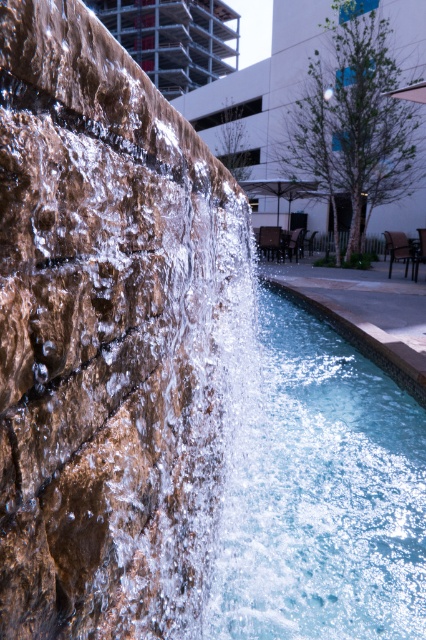
Question: Does clear glass swimming pool at center have a smaller size compared to smooth concrete wall at center?

Choices:
 (A) no
 (B) yes

Answer: (B)

Question: Which object is positioned farthest from the clear glass swimming pool at center?

Choices:
 (A) smooth concrete wall at center
 (B) metallic silver building at upper center
 (C) brown stone waterfall at left

Answer: (B)

Question: Is brown stone waterfall at left to the left of smooth concrete wall at center from the viewer's perspective?

Choices:
 (A) yes
 (B) no

Answer: (A)

Question: Does brown stone waterfall at left appear on the left side of metallic silver building at upper center?

Choices:
 (A) no
 (B) yes

Answer: (A)

Question: Which point is closer to the camera taking this photo?

Choices:
 (A) (178, 32)
 (B) (8, 218)
 (C) (264, 556)

Answer: (B)

Question: Which of the following is the closest to the observer?

Choices:
 (A) (236, 17)
 (B) (264, 116)
 (C) (423, 500)

Answer: (C)